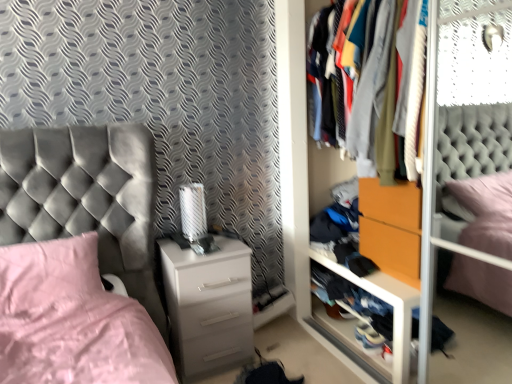
Find the location of a particular element. This screenshot has height=384, width=512. wooden drawer at right is located at coordinates (401, 343).

What do you see at coordinates (401, 343) in the screenshot? I see `wooden drawer at right` at bounding box center [401, 343].

The width and height of the screenshot is (512, 384). I want to click on white glossy chest of drawers at center, so click(208, 304).

The width and height of the screenshot is (512, 384). Identify the location of textured fabric clothes at center. 404,62.

Are white glossy chest of drawers at center and textured fabric clothes at center making contact?

No, white glossy chest of drawers at center is not making contact with textured fabric clothes at center.

Is white glossy chest of drawers at center at the left side of textured fabric clothes at center?

Yes.

From a real-world perspective, which object rests below the other?

white glossy chest of drawers at center, from a real-world perspective.

Where is `chest of drawers below the textured fabric clothes at center (from a real-world perspective)`? chest of drawers below the textured fabric clothes at center (from a real-world perspective) is located at coordinates (208, 304).

Is point (95, 244) behind point (407, 307)?

Yes, it is.

Is pink fabric pillow at lower left oriented away from wooden shelf at lower right?

No.

Where is `shelf that is on the right side of pink fabric pillow at lower left`? shelf that is on the right side of pink fabric pillow at lower left is located at coordinates (387, 302).

Is pink fabric pillow at lower left to the right of wooden shelf at lower right from the viewer's perspective?

In fact, pink fabric pillow at lower left is to the left of wooden shelf at lower right.

From a real-world perspective, is textured fabric clothes at center above or below white glossy chest of drawers at center?

In terms of real-world spatial position, textured fabric clothes at center is above white glossy chest of drawers at center.

Can you confirm if textured fabric clothes at center is smaller than white glossy chest of drawers at center?

No, textured fabric clothes at center is not smaller than white glossy chest of drawers at center.

Is textured fabric clothes at center inside the boundaries of white glossy chest of drawers at center, or outside?

textured fabric clothes at center is outside white glossy chest of drawers at center.

Is wooden shelf at lower right closer to the viewer compared to pink fabric pillow at lower left?

No.

In terms of height, does wooden shelf at lower right look taller or shorter compared to pink fabric pillow at lower left?

Result: Considering their sizes, wooden shelf at lower right has more height than pink fabric pillow at lower left.

Looking at their sizes, would you say wooden shelf at lower right is wider or thinner than pink fabric pillow at lower left?

wooden shelf at lower right is thinner than pink fabric pillow at lower left.

Is wooden shelf at lower right outside of pink fabric pillow at lower left?

Yes, wooden shelf at lower right is outside of pink fabric pillow at lower left.

Find the location of a particular element. The width and height of the screenshot is (512, 384). nightstand located above the pink fabric pillow at lower left (from a real-world perspective) is located at coordinates (391, 228).

From a real-world perspective, which object rests below the other?

pink fabric pillow at lower left, from a real-world perspective.

Does pink fabric pillow at lower left come in front of orange matte drawer at center?

That is True.

Is textured fabric clothes at center facing away from wooden shelf at lower right?

textured fabric clothes at center does not have its back to wooden shelf at lower right.

From the image's perspective, relative to wooden shelf at lower right, is textured fabric clothes at center above or below?

Clearly, from the image's perspective, textured fabric clothes at center is above wooden shelf at lower right.

Which point is more distant from viewer, (405, 102) or (399, 367)?

The point (399, 367) is farther.

How many degrees apart are the facing directions of textured fabric clothes at center and wooden shelf at lower right?

There is a 0.0874-degree angle between the facing directions of textured fabric clothes at center and wooden shelf at lower right.

Is pink fabric pillow at lower left aimed at wooden drawer at right?

No, pink fabric pillow at lower left does not turn towards wooden drawer at right.

Which object is further away from the camera, pink fabric pillow at lower left or wooden drawer at right?

pink fabric pillow at lower left.

Between pink fabric pillow at lower left and wooden drawer at right, which one appears on the left side from the viewer's perspective?

From the viewer's perspective, pink fabric pillow at lower left appears more on the left side.

Is point (6, 285) behind point (418, 291)?

No, it is not.

Locate an element on the screen. chest of drawers on the left of textured fabric clothes at center is located at coordinates (208, 304).

This screenshot has height=384, width=512. What are the coordinates of `shelf located underneath the pink fabric pillow at lower left (from a real-world perspective)` in the screenshot? It's located at (387, 302).

Which object lies further to the anchor point wooden drawer at right, textured fabric clothes at center or white glossy chest of drawers at center?

The object further to wooden drawer at right is textured fabric clothes at center.

Looking at the image, which one is located further to wooden shelf at lower right, textured fabric clothes at center or white glossy chest of drawers at center?

textured fabric clothes at center lies further to wooden shelf at lower right than the other object.

Based on their spatial positions, is wooden drawer at right or wooden shelf at lower right closer to white glossy chest of drawers at center?

wooden drawer at right lies closer to white glossy chest of drawers at center than the other object.

Looking at the image, which one is located closer to wooden shelf at lower right, textured fabric clothes at center or orange matte drawer at center?

orange matte drawer at center is closer to wooden shelf at lower right.

Based on their spatial positions, is white glossy chest of drawers at center or wooden drawer at right closer to orange matte drawer at center?

wooden drawer at right is positioned closer to the anchor orange matte drawer at center.

Looking at the image, which one is located closer to textured fabric clothes at center, orange matte drawer at center or wooden drawer at right?

Based on the image, orange matte drawer at center appears to be nearer to textured fabric clothes at center.

In the scene shown: When comparing their distances from orange matte drawer at center, does textured fabric clothes at center or pink fabric pillow at lower left seem further?

pink fabric pillow at lower left.

Which object lies further to the anchor point wooden drawer at right, wooden shelf at lower right or textured fabric clothes at center?

Based on the image, textured fabric clothes at center appears to be further to wooden drawer at right.

In order to click on nightstand between wooden drawer at right and wooden shelf at lower right from front to back in this screenshot , I will do `click(391, 228)`.

Where is `shelf between pink fabric pillow at lower left and wooden drawer at right in the horizontal direction`? The image size is (512, 384). shelf between pink fabric pillow at lower left and wooden drawer at right in the horizontal direction is located at coordinates (387, 302).

Image resolution: width=512 pixels, height=384 pixels. Find the location of `chest of drawers between pink fabric pillow at lower left and wooden shelf at lower right from left to right`. chest of drawers between pink fabric pillow at lower left and wooden shelf at lower right from left to right is located at coordinates (208, 304).

What are the coordinates of `nightstand between textured fabric clothes at center and white glossy chest of drawers at center vertically` in the screenshot? It's located at (391, 228).